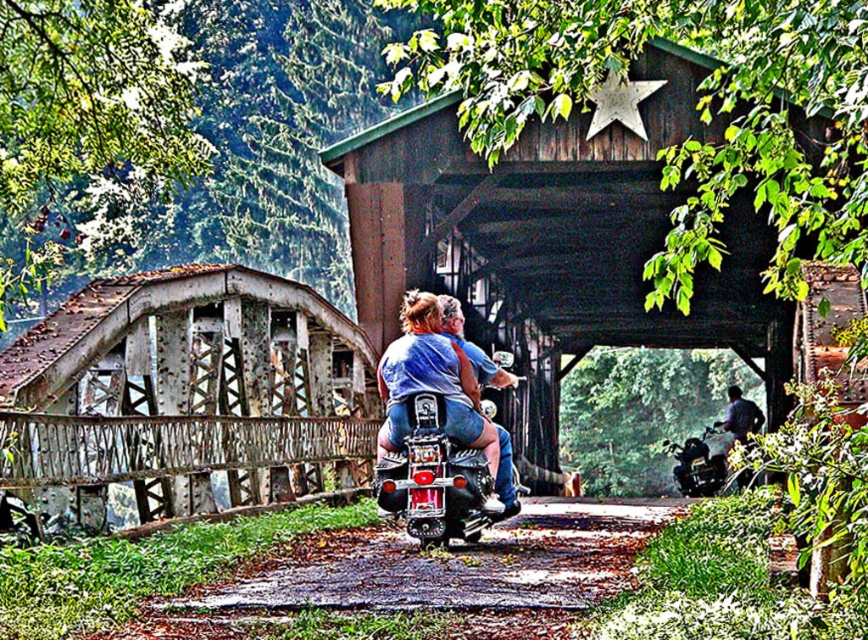
You are a photographer planning to capture a shot of the matte blue jeans at center and dark blue jeans at lower right. Since you want to ensure both are visible in the frame, which pair of jeans should you focus on to avoid cropping due to their size difference?

The matte blue jeans at center is narrower than the dark blue jeans at lower right. To ensure both are visible without cropping, focus on the wider dark blue jeans at lower right as the primary subject, allowing space for the narrower matte blue jeans at center in the frame.

You are planning to cross the rusty metal bridge at left with your car. The dark blue jeans at lower right are blocking the path. Can you pass through the bridge safely?

The rusty metal bridge at left might be wider than dark blue jeans at lower right, so there could be enough space to pass around the jeans if they are not occupying the entire width of the bridge. However, since the exact width difference isn not specified, proceed with caution.

You are a photographer planning to capture a wide shot of the scene. Given that the rusty metal bridge at left is larger in the frame compared to the matte blue jeans at center, which object should you focus on to ensure both are visible without cropping?

Focus on the rusty metal bridge at left since it is larger and central to the scene, allowing the matte blue jeans at center to remain visible in the frame without cropping.